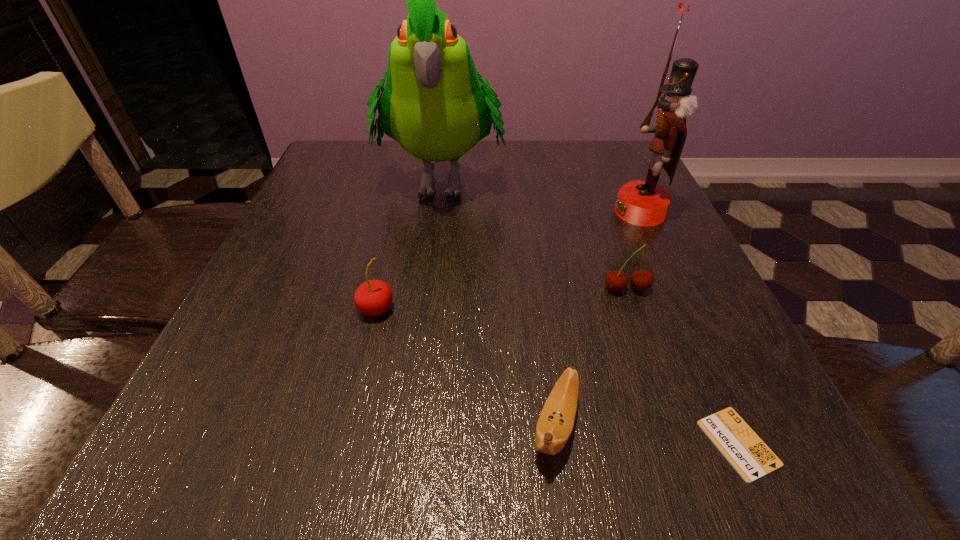
In order to click on parakeet in this screenshot , I will do `click(433, 104)`.

What are the coordinates of `nutcracker` in the screenshot? It's located at (646, 203).

You are a GUI agent. You are given a task and a screenshot of the screen. Output one action in this format:
    pyautogui.click(x=<x>, y=<y>)
    Task: Click on the left cherry
    This screenshot has width=960, height=540.
    Given the screenshot: What is the action you would take?
    pyautogui.click(x=374, y=297)

I want to click on the right cherry, so point(616,281).

I want to click on the second shortest object, so click(556, 421).

In order to click on the third object from left to right in this screenshot , I will do `click(556, 421)`.

This screenshot has height=540, width=960. What are the coordinates of `the shortest object` in the screenshot? It's located at (741, 446).

Image resolution: width=960 pixels, height=540 pixels. I want to click on vacant space situated 0.390m on the beak of the parakeet, so click(416, 390).

Locate an element on the screen. vacant region located on the front-facing side of the nutcracker is located at coordinates pyautogui.click(x=536, y=212).

At what (x,y) coordinates should I click in order to perform the action: click on free space located 0.050m on the front-facing side of the nutcracker. Please return your answer as a coordinate pair (x, y). Looking at the image, I should click on (591, 212).